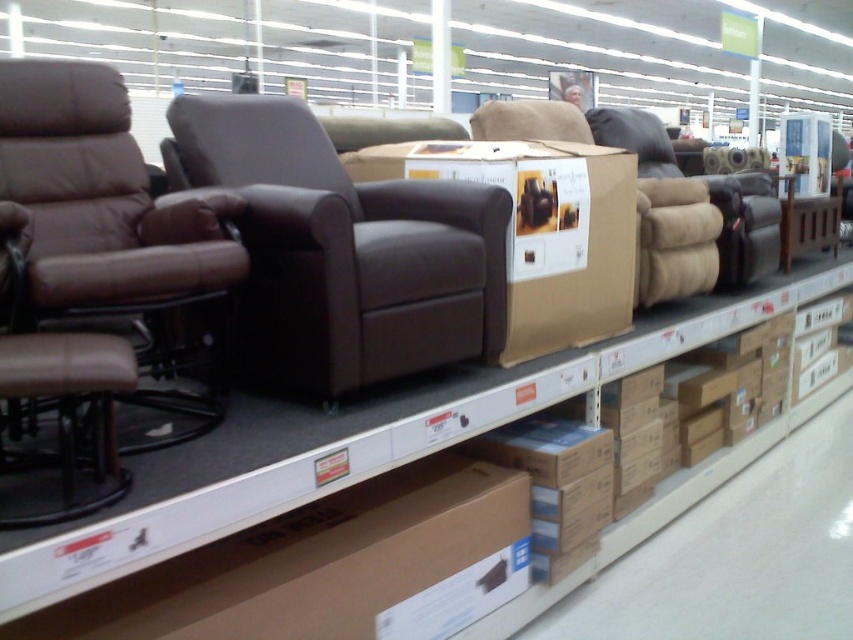
You are a customer looking to purchase a recliner and see the brown leather armchair at center and the brown leather swivel chair at left. Which one is positioned to the right of the other?

The brown leather armchair at center is to the right of the brown leather swivel chair at left.

You are standing in front of the furniture store display and see a point marked at coordinates (341,250). What object is located at that point?

The point at coordinates (341,250) marks the brown leather armchair at center.

You are a delivery person who needs to place a new camera on the floor near the brown leather armchair at center. The camera requires a minimum of 1.6 meters of space to avoid damaging the armchair. Is the current distance sufficient?

The brown leather armchair at center and camera are 1.63 meters apart, which exceeds the required 1.6 meters, so the distance is sufficient to avoid damaging the armchair.